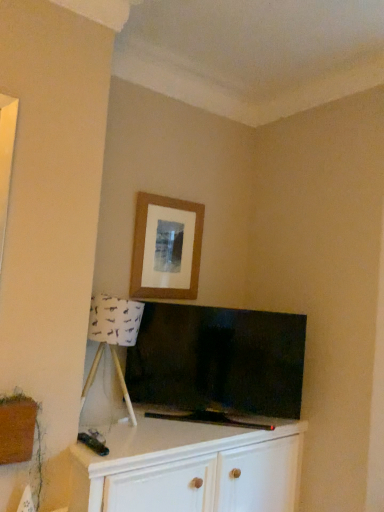
Question: Is wooden picture frame at upper center in front of or behind flat-screen tv at center in the image?

Choices:
 (A) front
 (B) behind

Answer: (B)

Question: From a real-world perspective, is wooden picture frame at upper center above or below flat-screen tv at center?

Choices:
 (A) above
 (B) below

Answer: (A)

Question: Which of these objects is positioned closest to the flat-screen tv at center?

Choices:
 (A) white fabric lampshade at lower left
 (B) white wood cabinet at lower center
 (C) wooden picture frame at upper center

Answer: (B)

Question: Estimate the real-world distances between objects in this image. Which object is farther from the white wood cabinet at lower center?

Choices:
 (A) flat-screen tv at center
 (B) white fabric lampshade at lower left
 (C) wooden picture frame at upper center

Answer: (C)